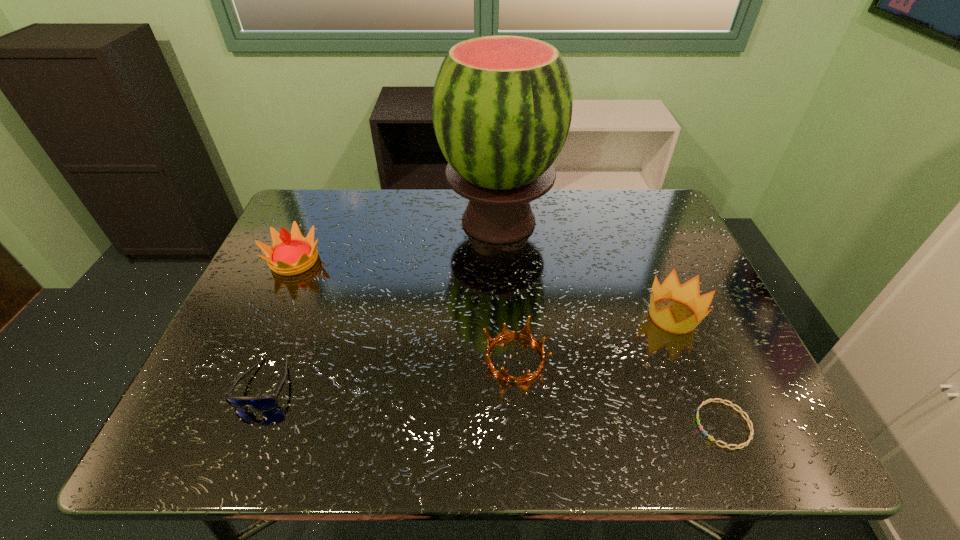
You are a GUI agent. You are given a task and a screenshot of the screen. Output one action in this format:
    pyautogui.click(x=<x>, y=<y>)
    Task: Click on the vacant space positioned on the front of the rightmost crown
    The width and height of the screenshot is (960, 540).
    Given the screenshot: What is the action you would take?
    pyautogui.click(x=700, y=382)

Identify the location of vacant space located on the right of the second crown from right to left. The width and height of the screenshot is (960, 540). (706, 358).

Identify the location of free spot located on the surface of the shortest object showing star-shaped elements. (655, 424).

This screenshot has height=540, width=960. In order to click on vacant space located on the surface of the shortest object showing star-shaped elements in this screenshot , I will do `click(571, 424)`.

You are a GUI agent. You are given a task and a screenshot of the screen. Output one action in this format:
    pyautogui.click(x=<x>, y=<y>)
    Task: Click on the free space located 0.250m on the surface of the shortest object showing star-shaped elements
    The width and height of the screenshot is (960, 540).
    Given the screenshot: What is the action you would take?
    pyautogui.click(x=565, y=424)

The width and height of the screenshot is (960, 540). I want to click on object located at the far edge, so click(x=502, y=105).

You are a GUI agent. You are given a task and a screenshot of the screen. Output one action in this format:
    pyautogui.click(x=<x>, y=<y>)
    Task: Click on the sunglasses situated at the near edge
    This screenshot has width=960, height=540.
    Given the screenshot: What is the action you would take?
    pyautogui.click(x=262, y=403)

Identify the location of bracelet that is at the near edge. Image resolution: width=960 pixels, height=540 pixels. (747, 419).

Locate an element on the screen. The image size is (960, 540). crown present at the left edge is located at coordinates (291, 254).

This screenshot has height=540, width=960. Identify the location of sunglasses that is at the left edge. (262, 403).